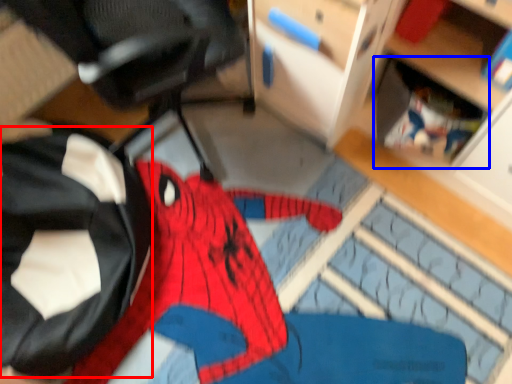
Question: Which of the following is the closest to the observer, clothing (highlighted by a red box) or shelf (highlighted by a blue box)?

Choices:
 (A) clothing
 (B) shelf

Answer: (A)